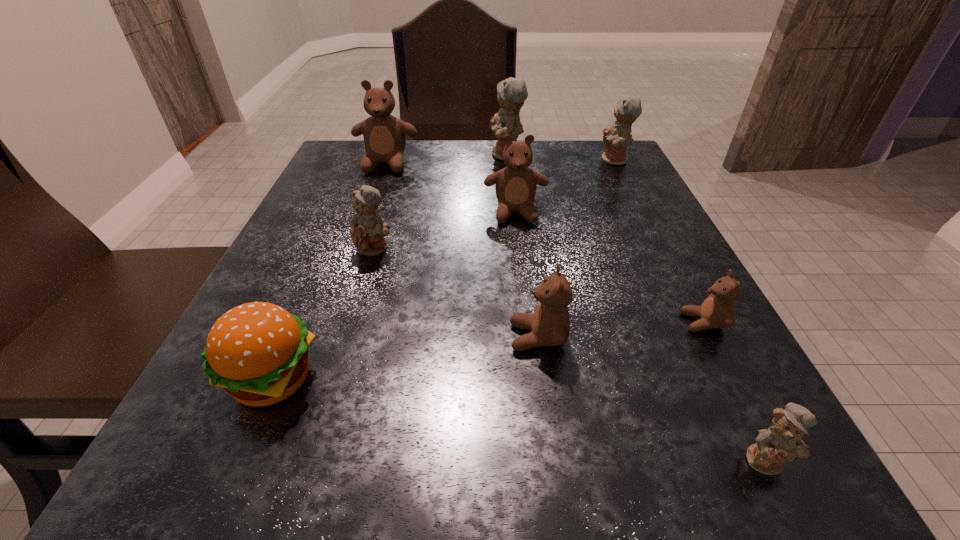
Where is `hamburger located in the left edge section of the desktop`? hamburger located in the left edge section of the desktop is located at coordinates (258, 352).

This screenshot has height=540, width=960. Find the location of `object located in the far left corner section of the desktop`. object located in the far left corner section of the desktop is located at coordinates (384, 136).

I want to click on object located at the far right corner, so click(616, 138).

Identify the location of object that is at the near right corner. This screenshot has width=960, height=540. pyautogui.click(x=782, y=440).

Identify the location of free spot at the far edge of the desktop. (471, 161).

Where is `free space at the near edge of the desktop`? free space at the near edge of the desktop is located at coordinates (547, 442).

In the image, there is a desktop. Identify the location of free space at the right edge. The image size is (960, 540). (639, 290).

The width and height of the screenshot is (960, 540). I want to click on free space at the far right corner, so click(601, 168).

This screenshot has height=540, width=960. Identify the location of free space that is in between the biggest blue teddy bear and the hamburger. pos(389,267).

Where is `free spot between the third biggest brown teddy bear and the third smallest brown teddy bear`? The image size is (960, 540). free spot between the third biggest brown teddy bear and the third smallest brown teddy bear is located at coordinates (527, 275).